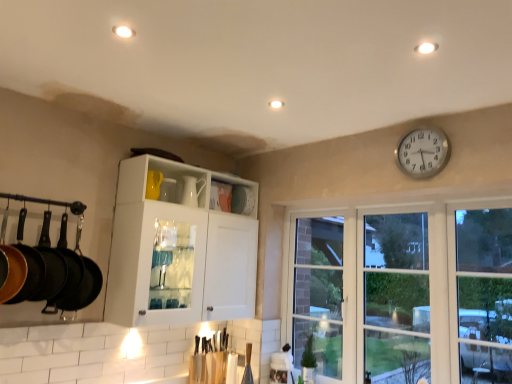
Question: Does white glossy cabinet at center have a larger size compared to transparent glass window at right?

Choices:
 (A) no
 (B) yes

Answer: (B)

Question: Is white glossy cabinet at center shorter than transparent glass window at right?

Choices:
 (A) yes
 (B) no

Answer: (A)

Question: Is white glossy cabinet at center taller than transparent glass window at right?

Choices:
 (A) yes
 (B) no

Answer: (B)

Question: From the image's perspective, is white glossy cabinet at center located above transparent glass window at right?

Choices:
 (A) no
 (B) yes

Answer: (B)

Question: Considering the relative sizes of white glossy cabinet at center and transparent glass window at right in the image provided, is white glossy cabinet at center smaller than transparent glass window at right?

Choices:
 (A) yes
 (B) no

Answer: (B)

Question: Considering the relative positions of white glossy cabinet at center and transparent glass window at right in the image provided, is white glossy cabinet at center to the right of transparent glass window at right from the viewer's perspective?

Choices:
 (A) yes
 (B) no

Answer: (B)

Question: Is matte black frying pan at left, the 3th frying pan viewed from the front, shorter than matte black frying pan at left, positioned as the 2th frying pan in front-to-back order?

Choices:
 (A) no
 (B) yes

Answer: (A)

Question: Is matte black frying pan at left, the 3th frying pan viewed from the front, at the left side of matte black frying pan at left, positioned as the 2th frying pan in front-to-back order?

Choices:
 (A) yes
 (B) no

Answer: (B)

Question: From the image's perspective, does matte black frying pan at left, the 3th frying pan viewed from the front, appear higher than matte black frying pan at left, positioned as the 2th frying pan in front-to-back order?

Choices:
 (A) yes
 (B) no

Answer: (B)

Question: Is matte black frying pan at left, the 3th frying pan viewed from the front, wider than matte black frying pan at left, which appears as the 3th frying pan when viewed from the back?

Choices:
 (A) yes
 (B) no

Answer: (B)

Question: Considering the relative sizes of matte black frying pan at left, the 3th frying pan viewed from the front, and matte black frying pan at left, which appears as the 3th frying pan when viewed from the back, in the image provided, is matte black frying pan at left, the 3th frying pan viewed from the front, thinner than matte black frying pan at left, which appears as the 3th frying pan when viewed from the back,?

Choices:
 (A) no
 (B) yes

Answer: (B)

Question: From a real-world perspective, does matte black frying pan at left, the 3th frying pan viewed from the front, sit lower than matte black frying pan at left, which appears as the 3th frying pan when viewed from the back?

Choices:
 (A) yes
 (B) no

Answer: (A)

Question: Can you confirm if black cast iron frying pan at left, positioned as the first frying pan in back-to-front order, is shorter than matte black frying pan at left, which ranks as the 2th frying pan in back-to-front order?

Choices:
 (A) yes
 (B) no

Answer: (B)